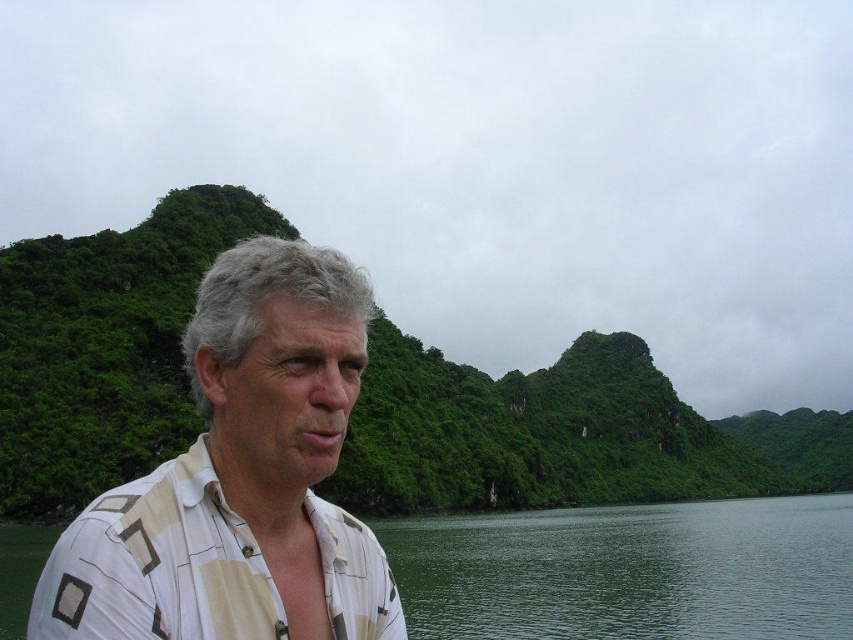
The width and height of the screenshot is (853, 640). What do you see at coordinates (241, 477) in the screenshot?
I see `white striped shirt at center` at bounding box center [241, 477].

Between white striped shirt at center and green water at lower left, which one has less height?

Standing shorter between the two is green water at lower left.

This screenshot has height=640, width=853. What are the coordinates of `white striped shirt at center` in the screenshot? It's located at (241, 477).